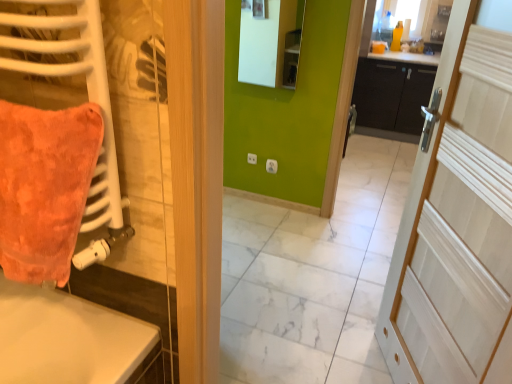
Question: Considering the positions of white wood door at right and orange plush throw pillow at left in the image, is white wood door at right wider or thinner than orange plush throw pillow at left?

Choices:
 (A) wide
 (B) thin

Answer: (B)

Question: From their relative heights in the image, would you say white wood door at right is taller or shorter than orange plush throw pillow at left?

Choices:
 (A) short
 (B) tall

Answer: (B)

Question: Estimate the real-world distances between objects in this image. Which object is farther from the white matte radiator at left?

Choices:
 (A) black matte cabinet at center
 (B) matte white mirror at upper center
 (C) white wood door at right
 (D) orange plush throw pillow at left

Answer: (A)

Question: Estimate the real-world distances between objects in this image. Which object is farther from the orange plush throw pillow at left?

Choices:
 (A) white wood door at right
 (B) matte white mirror at upper center
 (C) white matte radiator at left
 (D) black matte cabinet at center

Answer: (D)